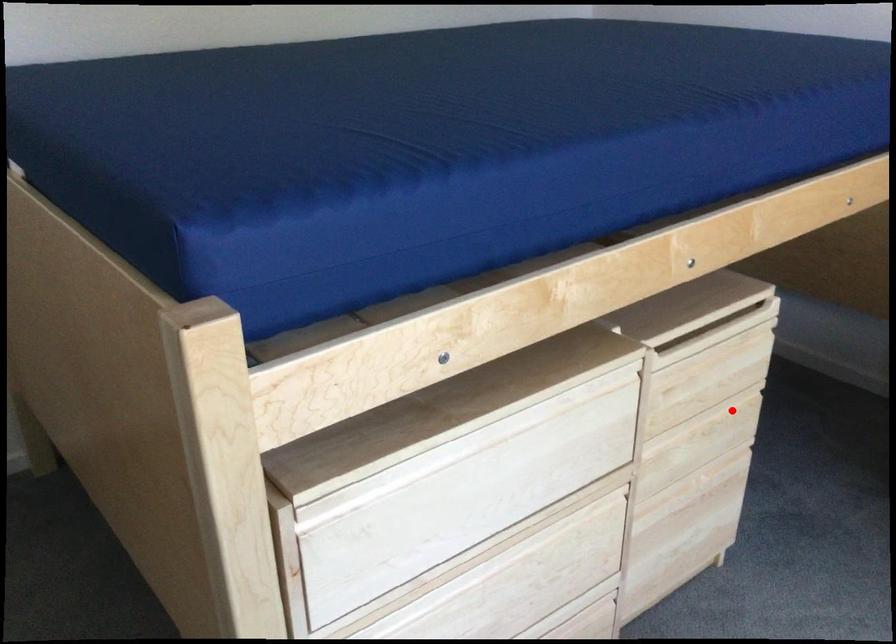
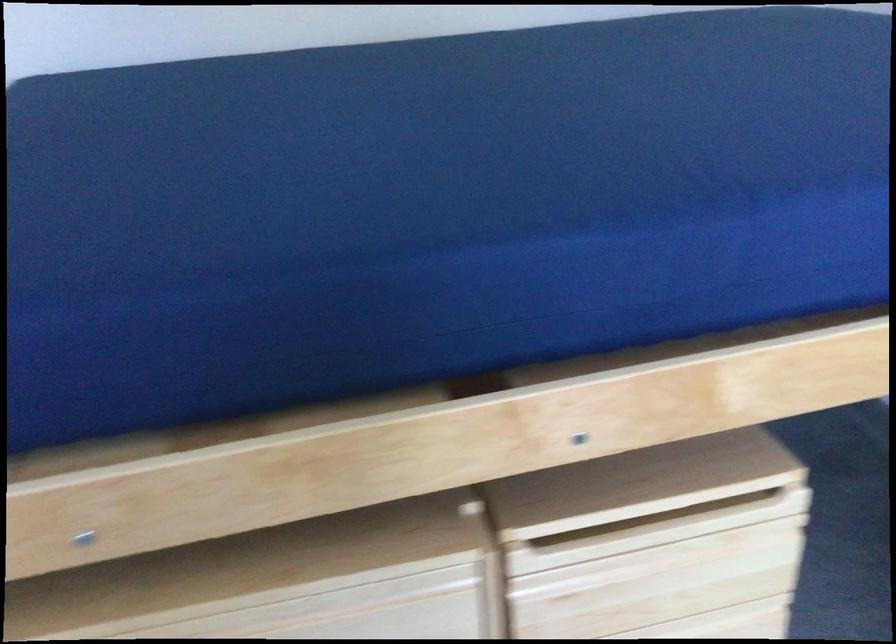
Locate, in the second image, the point that corresponds to the highlighted location in the first image.

(725, 623)